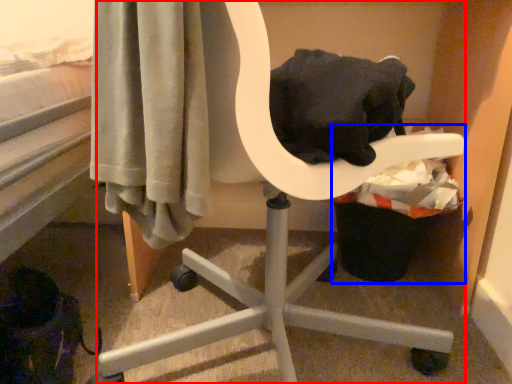
Question: Which of the following is the closest to the observer, chair (highlighted by a red box) or laundry basket (highlighted by a blue box)?

Choices:
 (A) chair
 (B) laundry basket

Answer: (A)